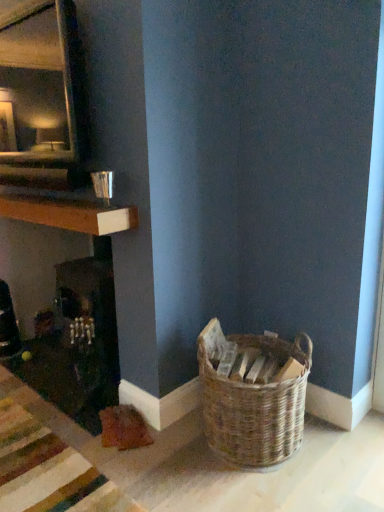
This screenshot has height=512, width=384. In order to click on free location in front of woven brown basket at lower right in this screenshot , I will do `click(266, 492)`.